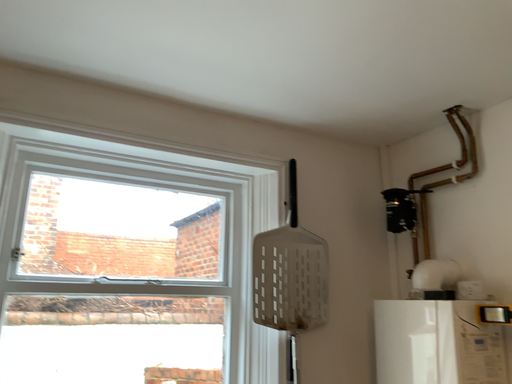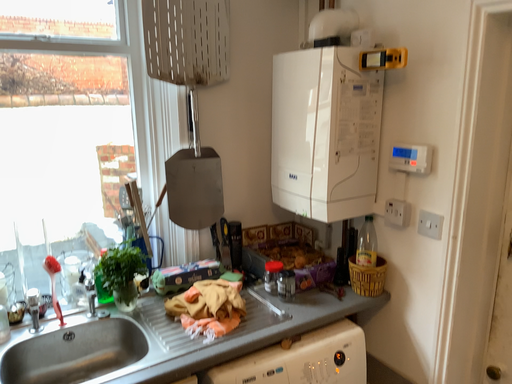
Question: Which way did the camera rotate in the video?

Choices:
 (A) rotated upward
 (B) rotated downward

Answer: (B)